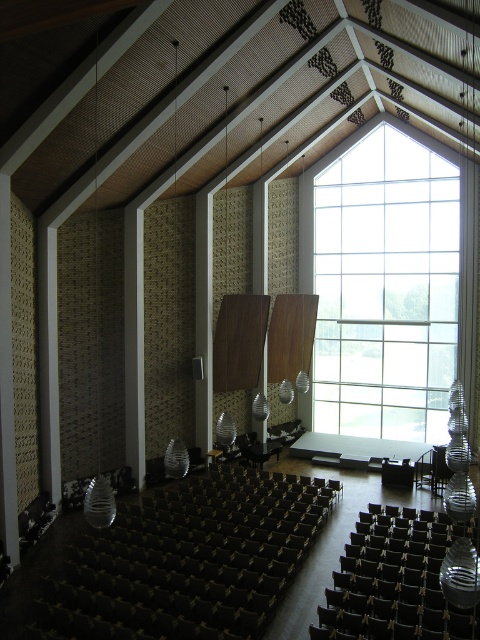
Image resolution: width=480 pixels, height=640 pixels. What do you see at coordinates (389, 282) in the screenshot?
I see `clear glass window at upper center` at bounding box center [389, 282].

Looking at this image, does clear glass window at upper center appear under black leather chair at lower center?

No.

Does point (352, 172) lie in front of point (409, 600)?

No, (352, 172) is further to viewer.

What are the coordinates of `clear glass window at upper center` in the screenshot? It's located at (389, 282).